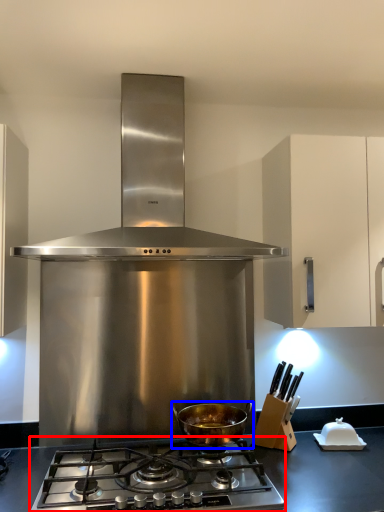
Question: Which point is further to the camera, gas stove (highlighted by a red box) or kitchen appliance (highlighted by a blue box)?

Choices:
 (A) gas stove
 (B) kitchen appliance

Answer: (B)